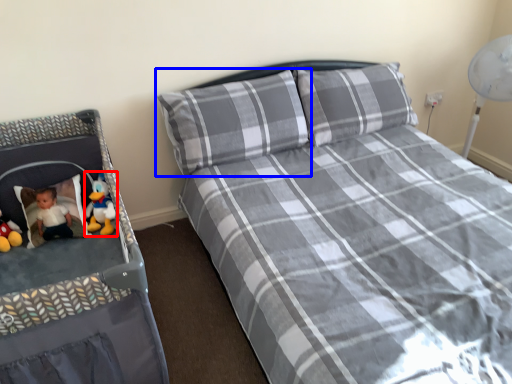
Question: Which object is closer to the camera taking this photo, toy (highlighted by a red box) or pillow (highlighted by a blue box)?

Choices:
 (A) toy
 (B) pillow

Answer: (B)